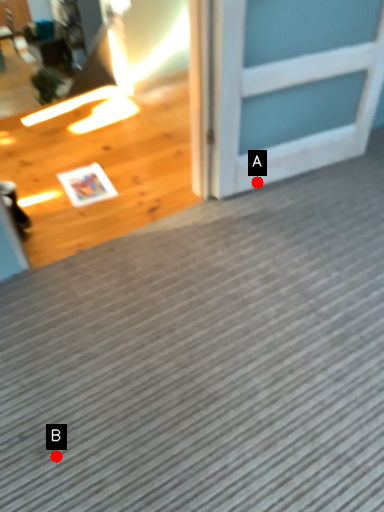
Question: Two points are circled on the image, labeled by A and B beside each circle. Which of the following is the farthest from the observer?

Choices:
 (A) A is further
 (B) B is further

Answer: (A)